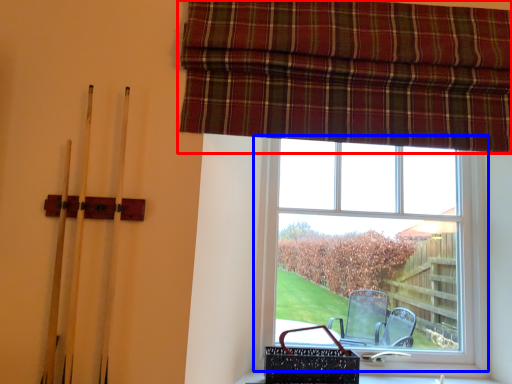
Question: Which object is further to the camera taking this photo, curtain (highlighted by a red box) or window (highlighted by a blue box)?

Choices:
 (A) curtain
 (B) window

Answer: (B)